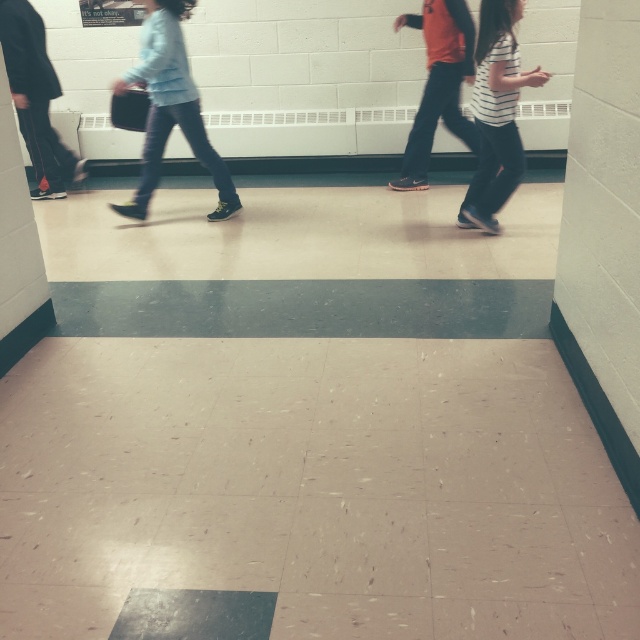
Question: Based on their relative distances, which object is nearer to the orange fabric shirt at center?

Choices:
 (A) light blue denim jacket at upper left
 (B) white striped shirt at center

Answer: (B)

Question: Is light blue denim jacket at upper left to the right of orange fabric shirt at center from the viewer's perspective?

Choices:
 (A) no
 (B) yes

Answer: (A)

Question: Can you confirm if white striped shirt at center is smaller than orange fabric shirt at center?

Choices:
 (A) no
 (B) yes

Answer: (B)

Question: Is light blue denim jacket at upper left to the right of orange fabric shirt at center from the viewer's perspective?

Choices:
 (A) yes
 (B) no

Answer: (B)

Question: Which point appears farthest from the camera in this image?

Choices:
 (A) (468, 17)
 (B) (467, 221)

Answer: (A)

Question: Estimate the real-world distances between objects in this image. Which object is farther from the white striped shirt at center?

Choices:
 (A) orange fabric shirt at center
 (B) light blue denim jacket at upper left

Answer: (B)